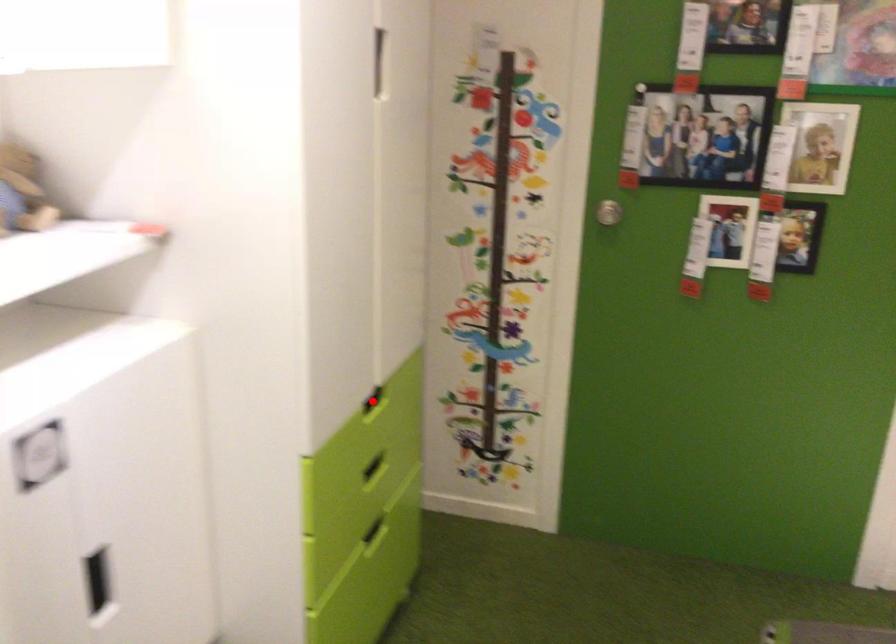
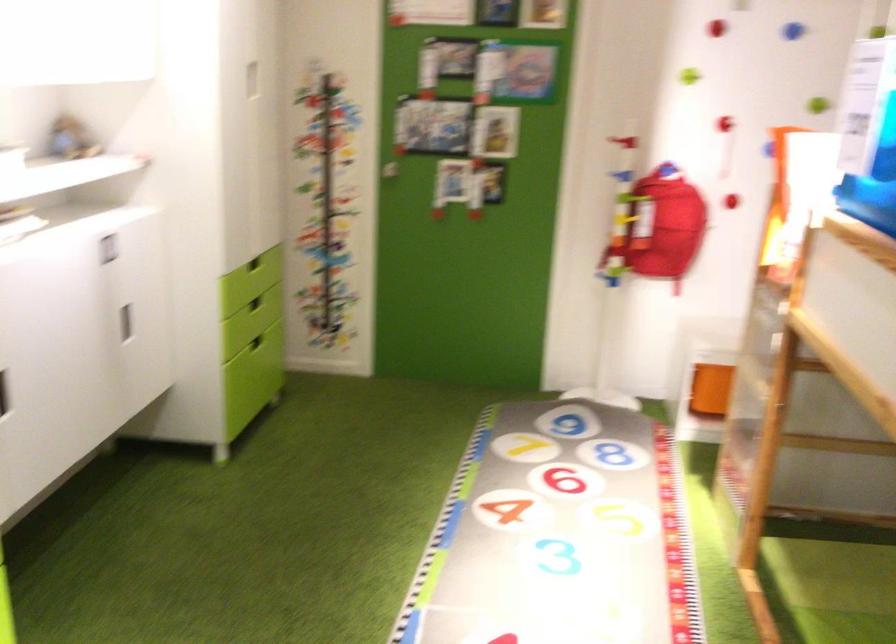
In the second image, find the point that corresponds to the highlighted location in the first image.

(253, 277)